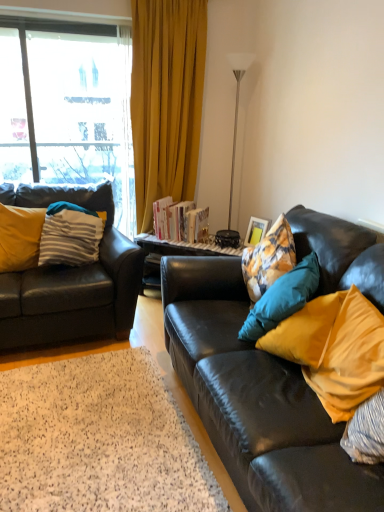
Question: Based on their positions, is matte yellow pillow at right, which ranks as the fourth pillow in left-to-right order, located to the left or right of matte wooden picture frame at right?

Choices:
 (A) right
 (B) left

Answer: (A)

Question: Is matte yellow pillow at right, the first pillow positioned from the right, in front of or behind matte wooden picture frame at right in the image?

Choices:
 (A) front
 (B) behind

Answer: (A)

Question: Which of these objects is positioned farthest from the matte black leather couch at left, acting as the 2th studio couch starting from the right?

Choices:
 (A) hardcover books at center
 (B) silver metallic floor lamp at upper right
 (C) striped fabric pillow at left, which is the first pillow in back-to-front order
 (D) clear glass window at left
 (E) matte yellow pillow at right, which appears as the 3th pillow when viewed from the left

Answer: (B)

Question: Which object is positioned closest to the striped fabric pillow at left, which is the 4th pillow from front to back?

Choices:
 (A) silver metallic floor lamp at upper right
 (B) hardcover books at center
 (C) black leather couch at right, the 1th studio couch viewed from the right
 (D) white shag rug at lower left
 (E) matte wooden picture frame at right

Answer: (B)